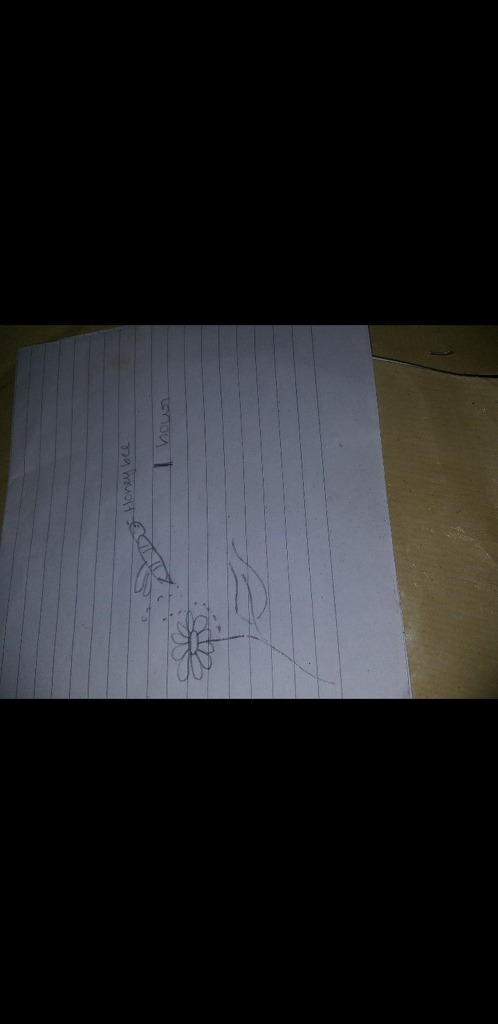
This screenshot has width=498, height=1024. In order to click on piece of paper in this screenshot , I will do click(368, 643).